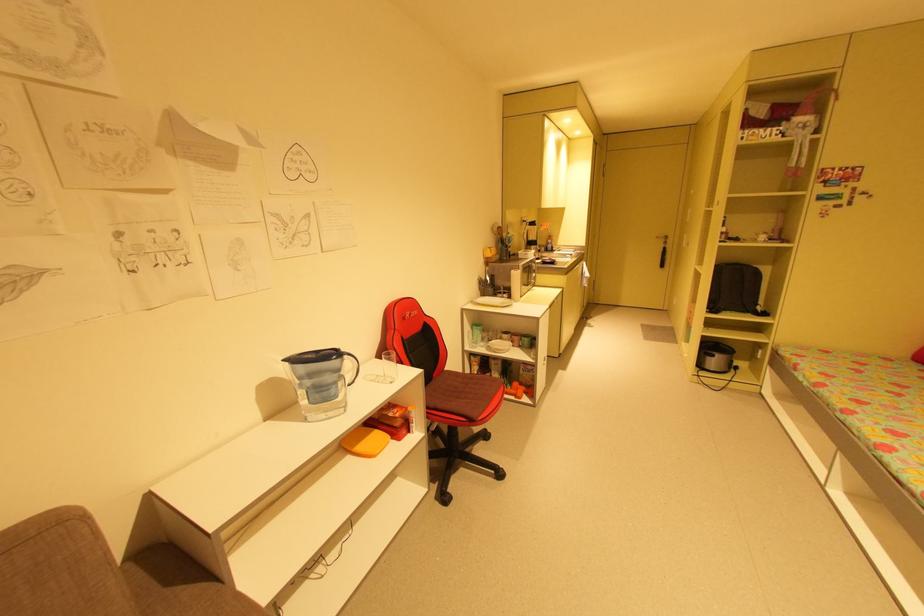
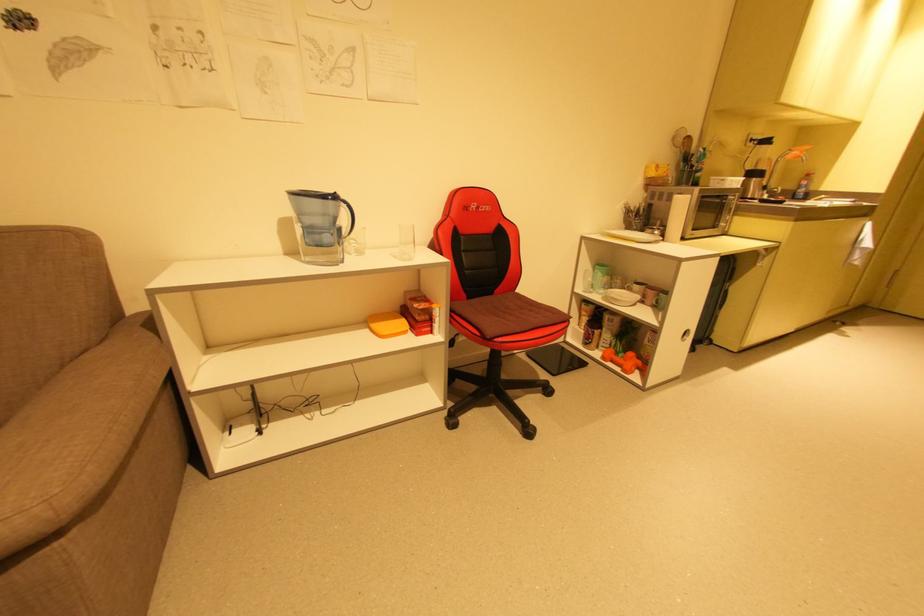
Locate, in the second image, the point that corresponds to the point at 348,357 in the first image.

(346, 204)